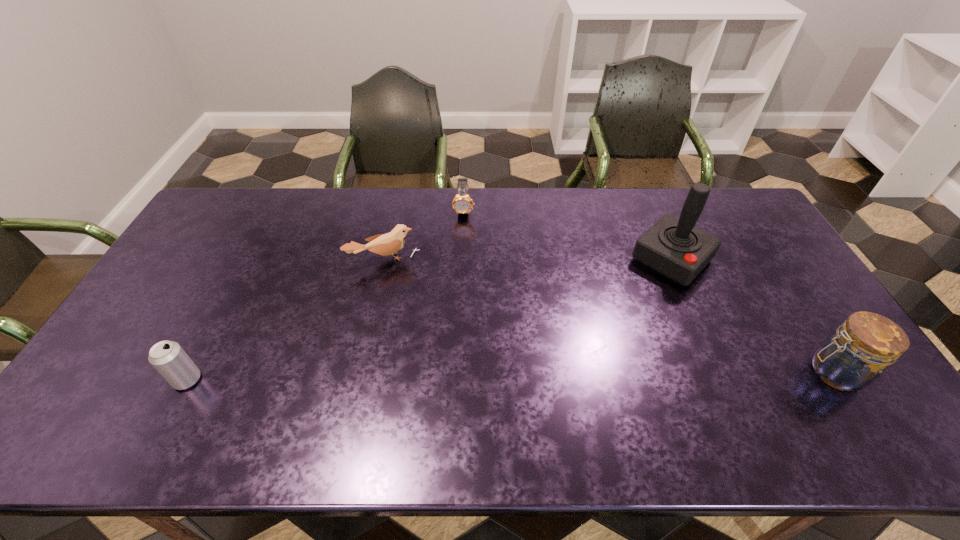
Where is `empty space between the fourth object from right to left and the joystick`? empty space between the fourth object from right to left and the joystick is located at coordinates (528, 260).

Where is `the second closest object to the rightmost object`? the second closest object to the rightmost object is located at coordinates (462, 203).

Where is `object that stands as the closest to the rightmost object`? object that stands as the closest to the rightmost object is located at coordinates (673, 247).

You are a GUI agent. You are given a task and a screenshot of the screen. Output one action in this format:
    pyautogui.click(x=<x>, y=<y>)
    Task: Click on the vacant region that satisfies the following two spatial constraints: 1. on the front side of the tallest object; 2. on the right side of the farthest object
    
    Given the screenshot: What is the action you would take?
    click(x=462, y=259)